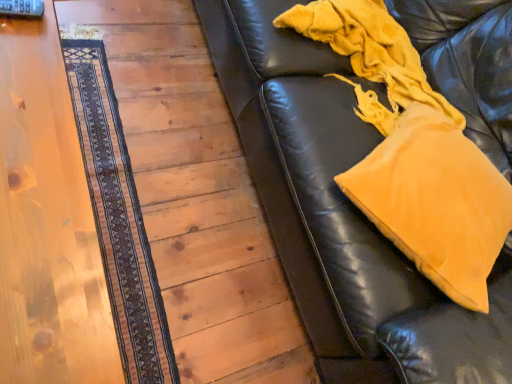
You are a GUI agent. You are given a task and a screenshot of the screen. Output one action in this format:
    pyautogui.click(x=<x>, y=<y>)
    Task: Click on the free point above wooden table at left (from a real-world perspective)
    Image resolution: width=512 pixels, height=384 pixels.
    Given the screenshot: What is the action you would take?
    pyautogui.click(x=38, y=173)